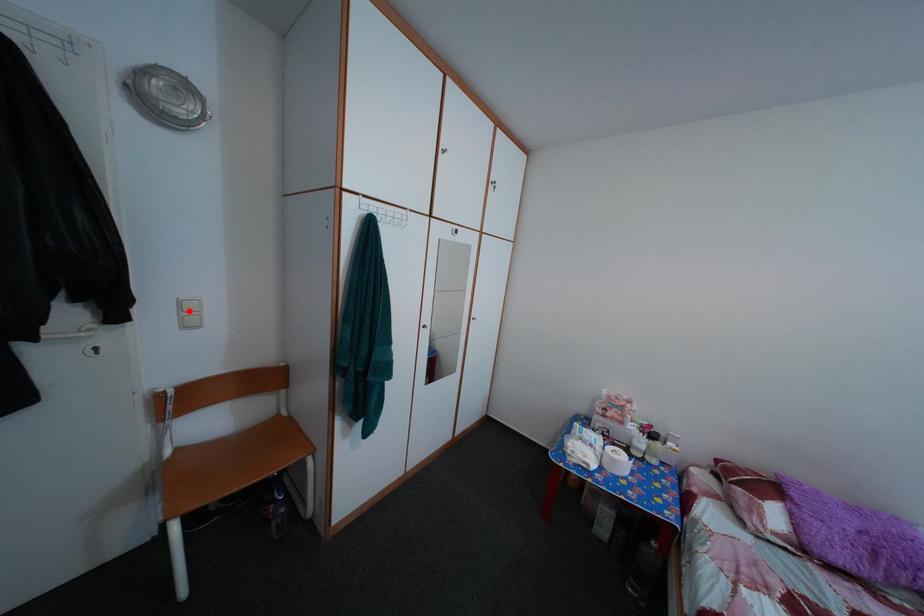
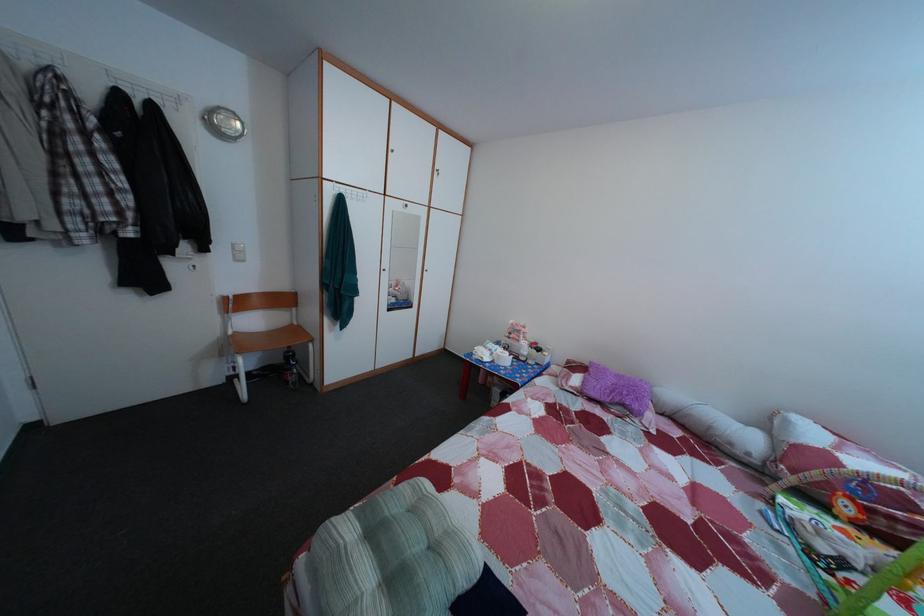
Question: I am providing you with two images of the same scene from different viewpoints. A red point is shown in image1. For the corresponding object point in image2, is it positioned nearer or farther from the camera?

Choices:
 (A) Nearer
 (B) Farther

Answer: (A)